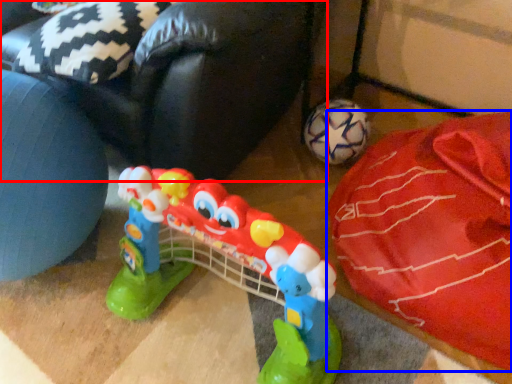
Question: Which point is closer to the camera, bean bag chair (highlighted by a red box) or material (highlighted by a blue box)?

Choices:
 (A) bean bag chair
 (B) material

Answer: (B)